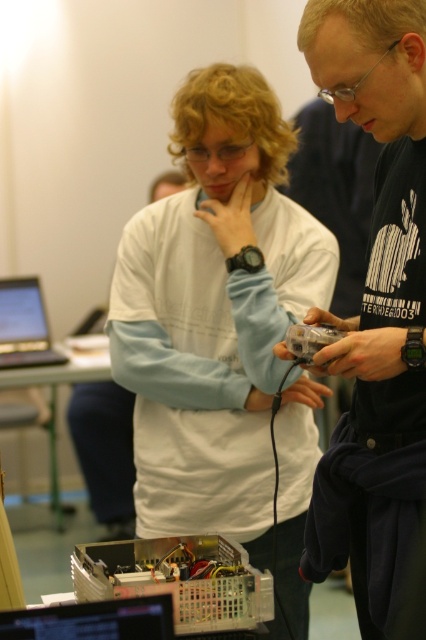
Question: Is black matte shirt at center in front of translucent plastic component at center?

Choices:
 (A) no
 (B) yes

Answer: (B)

Question: Can you confirm if black matte shirt at center is positioned to the right of translucent plastic component at center?

Choices:
 (A) yes
 (B) no

Answer: (A)

Question: Which object appears closest to the camera in this image?

Choices:
 (A) black glossy laptop at lower left
 (B) matte black laptop at left
 (C) translucent plastic component at center
 (D) white matte shirt at center

Answer: (A)

Question: Considering the real-world distances, which object is farthest from the black matte shirt at center?

Choices:
 (A) black glossy laptop at lower left
 (B) translucent plastic component at center
 (C) matte black laptop at left
 (D) white matte shirt at center

Answer: (C)

Question: Estimate the real-world distances between objects in this image. Which object is farther from the metallic circuit board at center?

Choices:
 (A) translucent plastic component at center
 (B) black glossy laptop at lower left
 (C) black matte shirt at center
 (D) white matte shirt at center

Answer: (D)

Question: Does black matte shirt at center have a greater width compared to black glossy laptop at lower left?

Choices:
 (A) yes
 (B) no

Answer: (A)